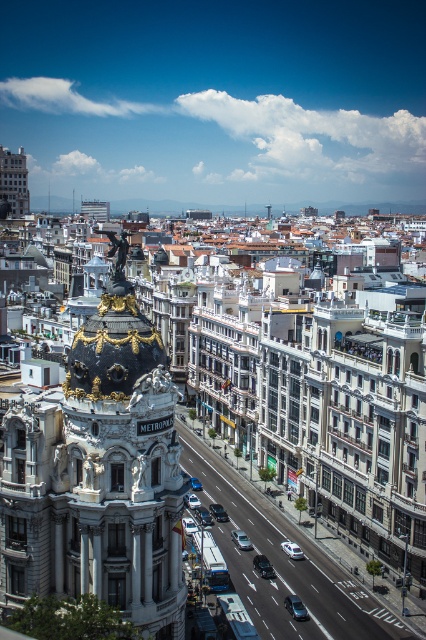
You are a delivery driver who needs to park your vehicle in a narrow alley. You have a white glossy car at center and a metallic silver car at center. Which car would you choose to park in the alley if you want to minimize the risk of scratching the sides?

The metallic silver car at center is less likely to get scratched because it is narrower than the white glossy car at center.